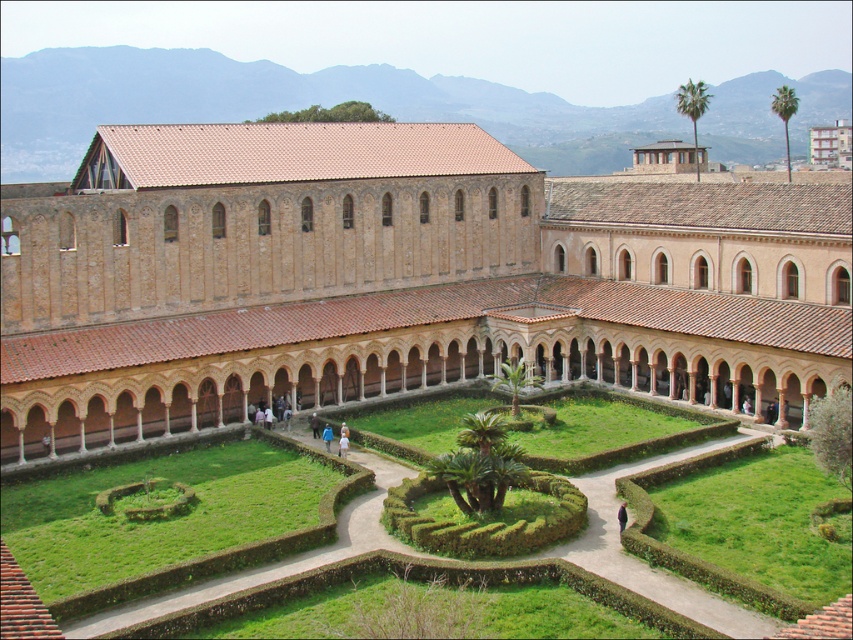
You are standing in the cloister and want to take a photo of both the point at coordinates [9,410] and the point at [329,426]. Which point should you focus on first to ensure both are in clear view?

You should focus on point [9,410] first because it is closer to the camera than point [329,426]. This way, both points will be in focus as the closer point determines the focal plane.

You are standing in the cloister and want to walk from the brown brick building at center to the green grass at center. Which direction should you move?

You should move to the right, as the brown brick building at center is to the left of the green grass at center.